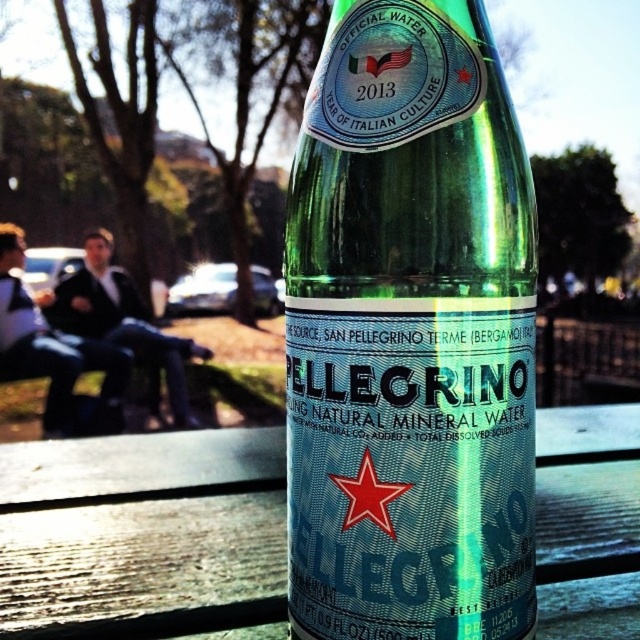
Question: Among these points, which one is nearest to the camera?

Choices:
 (A) (124, 496)
 (B) (420, 108)

Answer: (B)

Question: Which of the following is the farthest from the observer?

Choices:
 (A) green glass bottle at center
 (B) wooden bench at center

Answer: (B)

Question: Can you confirm if green glass bottle at center is wider than wooden bench at center?

Choices:
 (A) no
 (B) yes

Answer: (A)

Question: Can you confirm if green glass bottle at center is bigger than wooden bench at center?

Choices:
 (A) no
 (B) yes

Answer: (B)

Question: Which of the following is the farthest from the observer?

Choices:
 (A) (12, 522)
 (B) (442, 529)

Answer: (A)

Question: Is green glass bottle at center below wooden bench at center?

Choices:
 (A) no
 (B) yes

Answer: (A)